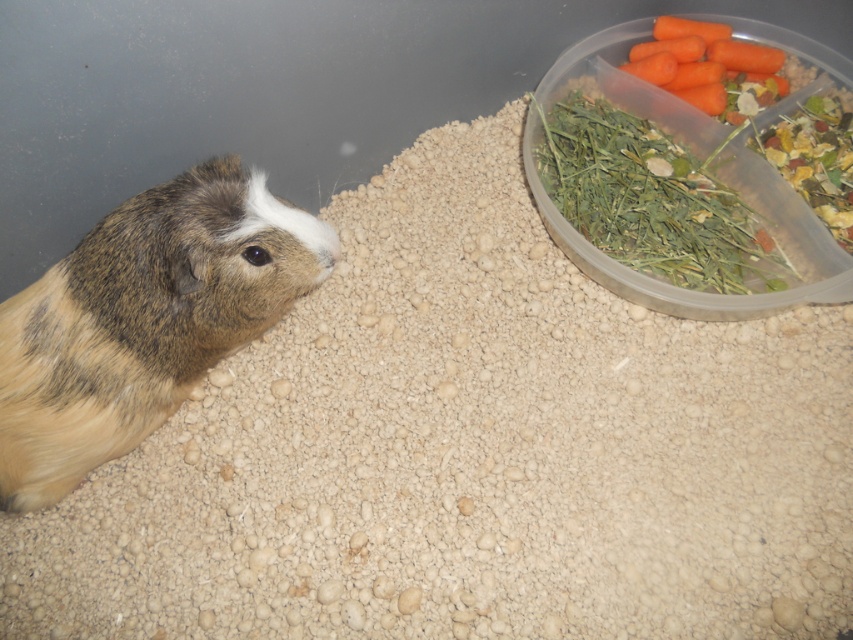
Question: Among these objects, which one is farthest from the camera?

Choices:
 (A) orange matte carrot at upper right
 (B) green leafy hay at upper right
 (C) brown fur hamster at left

Answer: (A)

Question: Is brown fur hamster at left further to the viewer compared to green leafy hay at upper right?

Choices:
 (A) yes
 (B) no

Answer: (B)

Question: Among these objects, which one is nearest to the camera?

Choices:
 (A) brown fur hamster at left
 (B) green leafy hay at upper right

Answer: (A)

Question: Is brown fur hamster at left thinner than orange matte carrot at upper right?

Choices:
 (A) yes
 (B) no

Answer: (B)

Question: Which object appears closest to the camera in this image?

Choices:
 (A) orange matte carrot at upper right
 (B) brown fur hamster at left
 (C) green leafy hay at upper right

Answer: (B)

Question: Where is brown fur hamster at left located in relation to orange matte carrot at upper right in the image?

Choices:
 (A) below
 (B) above

Answer: (A)